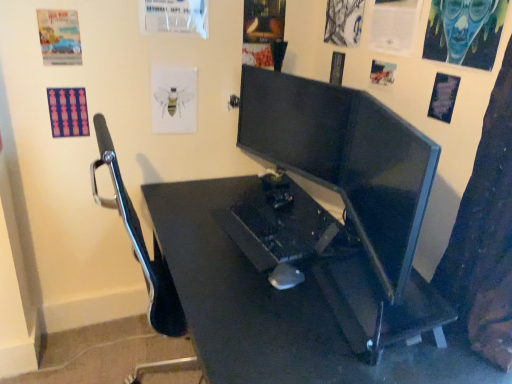
Where is `blank space to the left of black plastic mouse at center`? blank space to the left of black plastic mouse at center is located at coordinates (230, 278).